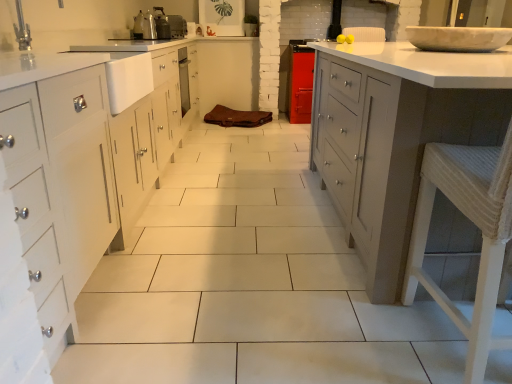
Question: From the image's perspective, is metallic silver toaster at upper center, which is the 2th appliance in top-to-bottom order, positioned above or below white marble bowl at upper right?

Choices:
 (A) above
 (B) below

Answer: (A)

Question: Considering the relative positions of metallic silver toaster at upper center, positioned as the 2th appliance in back-to-front order, and white marble bowl at upper right in the image provided, is metallic silver toaster at upper center, positioned as the 2th appliance in back-to-front order, to the left or to the right of white marble bowl at upper right?

Choices:
 (A) right
 (B) left

Answer: (B)

Question: Which object is the farthest from the white glossy countertop at right?

Choices:
 (A) white woven bar stool at right
 (B) metallic silver toaster at upper center, which ranks as the 1th appliance in front-to-back order
 (C) metallic silver toaster at upper center, the 1th appliance when ordered from top to bottom
 (D) white marble bowl at upper right

Answer: (C)

Question: Which object is the farthest from the white marble bowl at upper right?

Choices:
 (A) metallic silver toaster at upper center, positioned as the 2th appliance in back-to-front order
 (B) white glossy countertop at right
 (C) white woven bar stool at right
 (D) metallic silver toaster at upper center, the 1th appliance when ordered from top to bottom

Answer: (D)